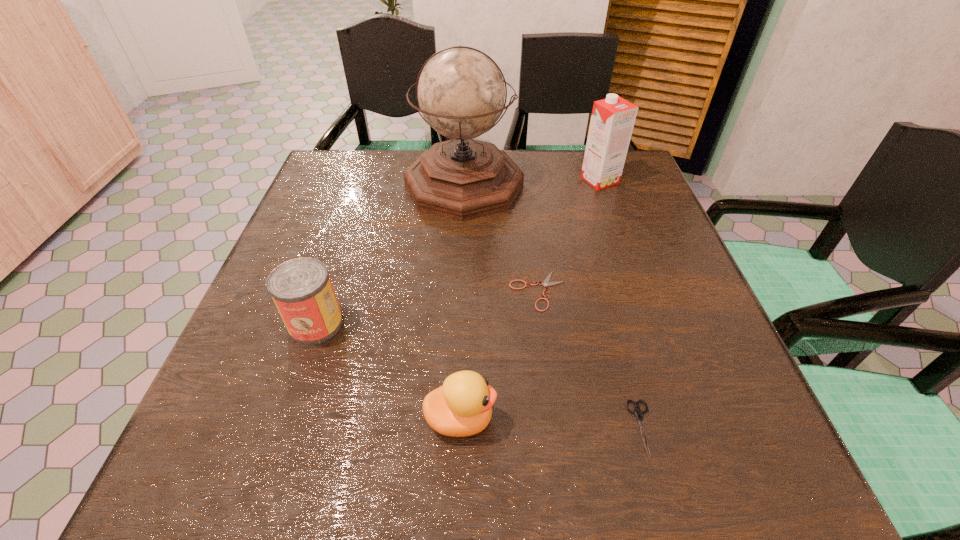
Find the location of `vacant space situated 0.310m on the front of the carton`. vacant space situated 0.310m on the front of the carton is located at coordinates (633, 275).

Where is `vacant region located 0.300m on the back of the can`? The width and height of the screenshot is (960, 540). vacant region located 0.300m on the back of the can is located at coordinates (353, 211).

What are the coordinates of `vacant space located 0.060m on the face of the duckling` in the screenshot? It's located at (534, 419).

Identify the location of vacant space located on the front of the taller shears. (661, 496).

Image resolution: width=960 pixels, height=540 pixels. Find the location of `free region located on the left of the shorter shears`. free region located on the left of the shorter shears is located at coordinates (400, 291).

Find the location of a particular element. Image resolution: width=960 pixels, height=540 pixels. globe located in the far edge section of the desktop is located at coordinates (461, 92).

I want to click on carton at the far edge, so click(x=612, y=120).

Where is `duckling located in the near edge section of the desktop`? Image resolution: width=960 pixels, height=540 pixels. duckling located in the near edge section of the desktop is located at coordinates [x=462, y=407].

Find the location of a particular element. shears at the near edge is located at coordinates (637, 411).

Locate an element on the screen. The height and width of the screenshot is (540, 960). object located at the left edge is located at coordinates (301, 288).